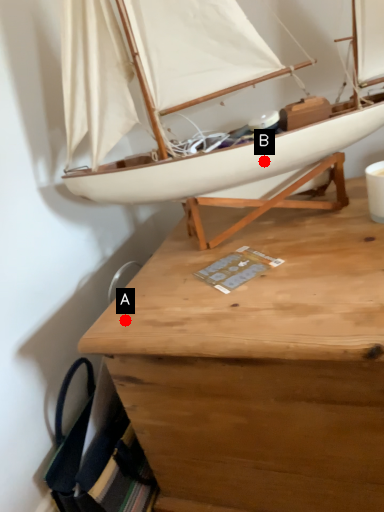
Question: Two points are circled on the image, labeled by A and B beside each circle. Which point appears closest to the camera in this image?

Choices:
 (A) A is closer
 (B) B is closer

Answer: (A)